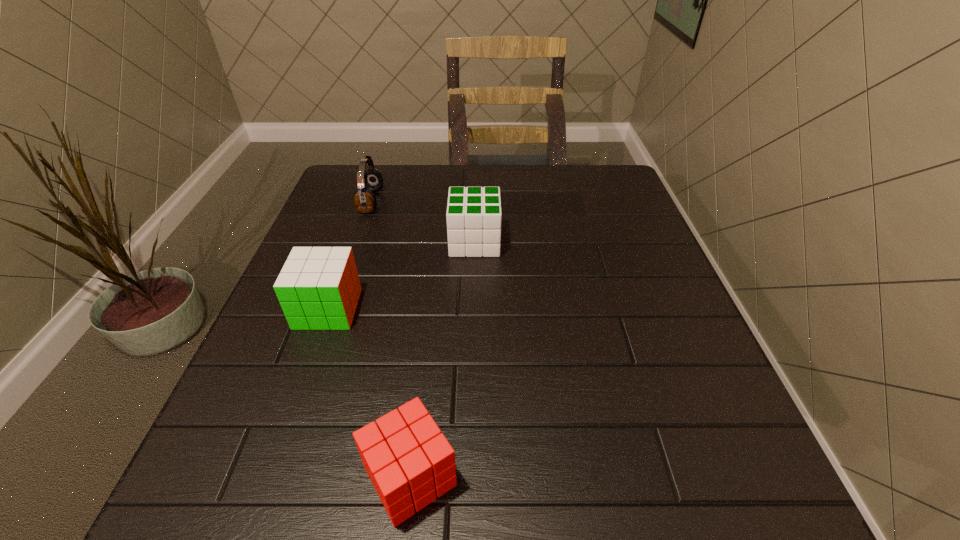
Where is `object present at the far edge`? Image resolution: width=960 pixels, height=540 pixels. object present at the far edge is located at coordinates (369, 180).

This screenshot has width=960, height=540. Find the location of `object that is at the near edge`. object that is at the near edge is located at coordinates click(409, 461).

Where is `headset at the left edge`? headset at the left edge is located at coordinates (369, 180).

I want to click on cube that is positioned at the left edge, so click(x=318, y=288).

I want to click on object that is at the far left corner, so click(x=369, y=180).

The image size is (960, 540). In order to click on vacant area at the far edge of the desktop in this screenshot , I will do `click(430, 170)`.

The image size is (960, 540). Find the location of `free region at the near edge`. free region at the near edge is located at coordinates (324, 497).

You are a GUI agent. You are given a task and a screenshot of the screen. Output one action in this format:
    pyautogui.click(x=<x>, y=<y>)
    Task: Click on the free space at the left edge
    The height and width of the screenshot is (540, 960).
    Given the screenshot: What is the action you would take?
    point(346,345)

Where is `vacant space at the right edge of the desktop`? The height and width of the screenshot is (540, 960). vacant space at the right edge of the desktop is located at coordinates (633, 241).

In order to click on vacant space at the far left corner of the desktop in this screenshot , I will do `click(343, 186)`.